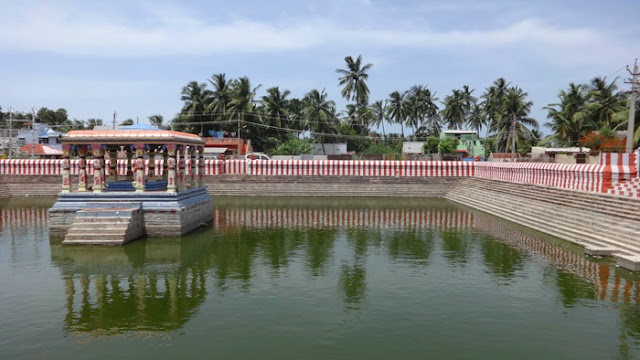
At what (x,y) coordinates should I click in order to perform the action: click on pillar. Please return your answer as a coordinate pair (x, y). Image resolution: width=640 pixels, height=360 pixels. Looking at the image, I should click on (203, 181).